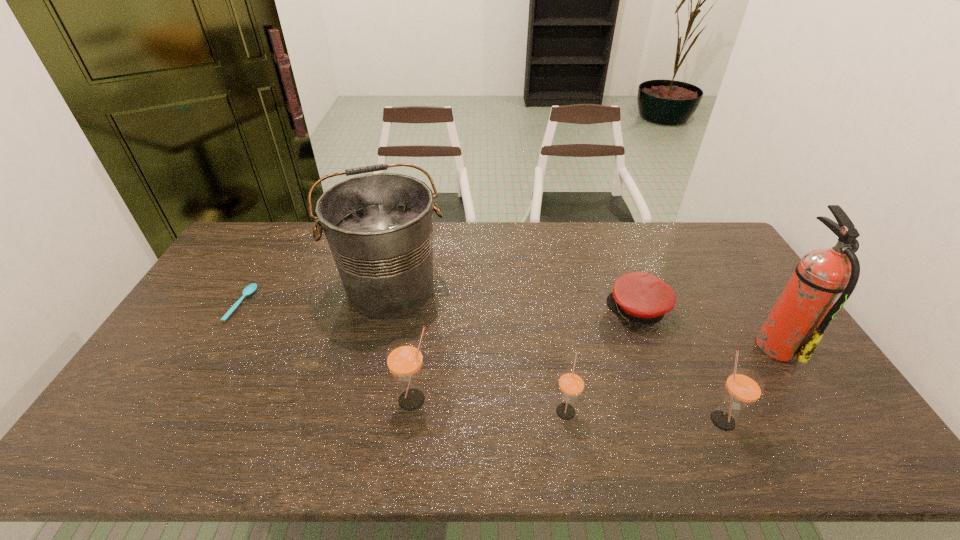
At what (x,y) coordinates should I click in order to perform the action: click on blank space located at the nozzle of the fire extinguisher. Please return your answer as a coordinate pair (x, y). This screenshot has width=960, height=540. Looking at the image, I should click on (721, 345).

At what (x,y) coordinates should I click in order to perform the action: click on object that is at the far edge. Please return your answer as a coordinate pair (x, y). Image resolution: width=960 pixels, height=540 pixels. Looking at the image, I should click on (379, 227).

This screenshot has height=540, width=960. I want to click on object located at the left edge, so click(x=250, y=289).

Locate an element on the screen. This screenshot has height=540, width=960. object located in the right edge section of the desktop is located at coordinates (825, 278).

In the image, there is a desktop. Where is `free region at the far edge`? The image size is (960, 540). free region at the far edge is located at coordinates (664, 258).

This screenshot has height=540, width=960. What are the coordinates of `vacant space at the near edge of the desktop` in the screenshot? It's located at (510, 418).

Image resolution: width=960 pixels, height=540 pixels. In the image, there is a desktop. What are the coordinates of `blank space at the right edge` in the screenshot? It's located at (810, 383).

I want to click on unoccupied position between the shortest straw and the second tallest straw, so click(644, 415).

Image resolution: width=960 pixels, height=540 pixels. I want to click on vacant point located between the cap and the bucket, so click(514, 299).

Find the location of a particular element. Image resolution: width=960 pixels, height=540 pixels. vacant region between the leftmost straw and the spoon is located at coordinates tap(328, 352).